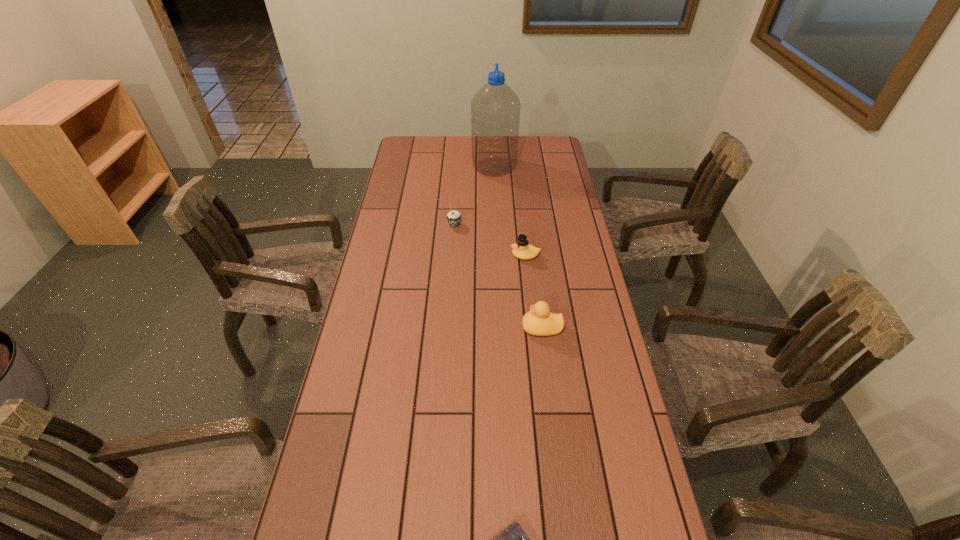
Identify the location of empty location between the cupcake and the nearer duck. (498, 276).

This screenshot has height=540, width=960. I want to click on empty location between the cupcake and the shorter duck, so click(x=490, y=240).

I want to click on free space between the cupcake and the shorter duck, so click(x=490, y=240).

The height and width of the screenshot is (540, 960). I want to click on vacant space in between the taller duck and the cupcake, so click(498, 276).

Identify the location of free space between the fourth nearest object and the farther duck. (490, 240).

Identify which object is the closest to the cupcake. Please provide its 2D coordinates. Your answer should be formatted as a tuple, i.e. [(x, y)], where the tuple contains the x and y coordinates of a point satisfying the conditions above.

[(522, 249)]

Where is `object that is the third closest to the farther duck`? object that is the third closest to the farther duck is located at coordinates (495, 109).